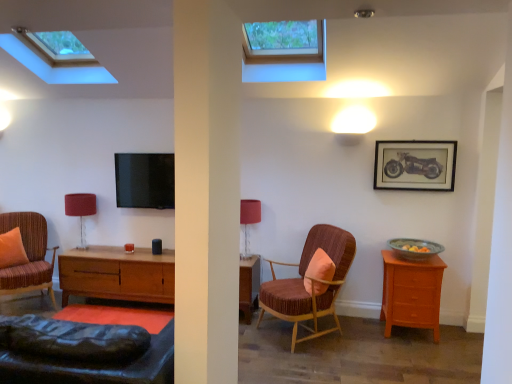
Question: From the image's perspective, is matte red table lamp at center, marked as the first table lamp in a front-to-back arrangement, above or below orange fabric pillow at center, the 2th pillow when ordered from left to right?

Choices:
 (A) below
 (B) above

Answer: (B)

Question: From their relative heights in the image, would you say matte red table lamp at center, marked as the first table lamp in a front-to-back arrangement, is taller or shorter than orange fabric pillow at center, which ranks as the second pillow in back-to-front order?

Choices:
 (A) short
 (B) tall

Answer: (B)

Question: Based on their relative distances, which object is nearer to the striped fabric armchair at left, marked as the second chair in a right-to-left arrangement?

Choices:
 (A) orange fabric pillow at left, the 1th pillow in the left-to-right sequence
 (B) light brown wood nightstand at right
 (C) green glazed bowl at right
 (D) velvet-like brown armchair at center, the 1th chair viewed from the right
 (E) matte red table lamp at center, marked as the first table lamp in a front-to-back arrangement

Answer: (A)

Question: Which object is the closest to the transparent glass skylight at upper center, the first window in the left-to-right sequence?

Choices:
 (A) wooden framed motorcycle print at upper right
 (B) transparent glass window at upper center, marked as the 1th window in a right-to-left arrangement
 (C) green glazed bowl at right
 (D) velvet-like brown armchair at center, which is the second chair in left-to-right order
 (E) orange fabric pillow at center, the 2th pillow when ordered from left to right

Answer: (B)